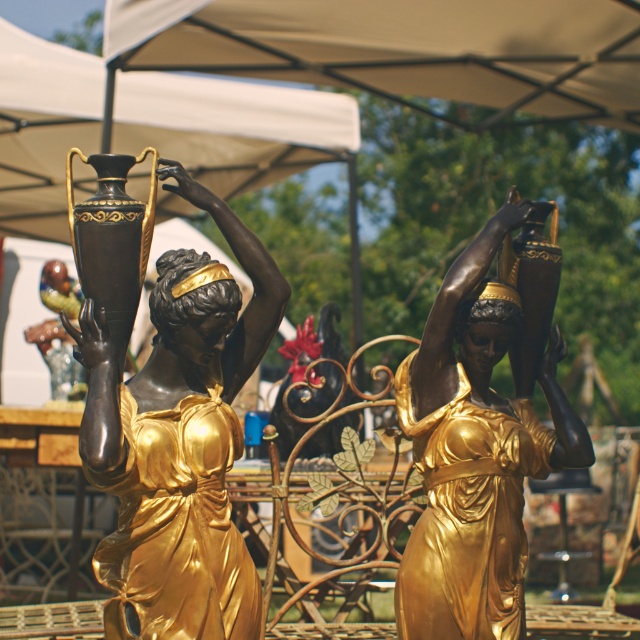
Question: Which object is farther from the camera taking this photo?

Choices:
 (A) gold polished statue at center
 (B) gold polished statue head at center
 (C) gold-bronze head at center

Answer: (B)

Question: Observing the image, what is the correct spatial positioning of gold-bronze statue at center in reference to gold-bronze head at center?

Choices:
 (A) left
 (B) right

Answer: (A)

Question: Is gold polished statue at center bigger than gold-bronze head at center?

Choices:
 (A) no
 (B) yes

Answer: (B)

Question: Which object is the farthest from the gold polished statue at center?

Choices:
 (A) gold polished statue head at center
 (B) gold-bronze head at center

Answer: (B)

Question: Considering the relative positions of gold-bronze head at center and gold polished statue head at center in the image provided, where is gold-bronze head at center located with respect to gold polished statue head at center?

Choices:
 (A) right
 (B) left

Answer: (B)

Question: Among these points, which one is farthest from the camera?

Choices:
 (A) (497, 618)
 (B) (460, 321)
 (C) (186, 600)
 (D) (186, 292)

Answer: (A)